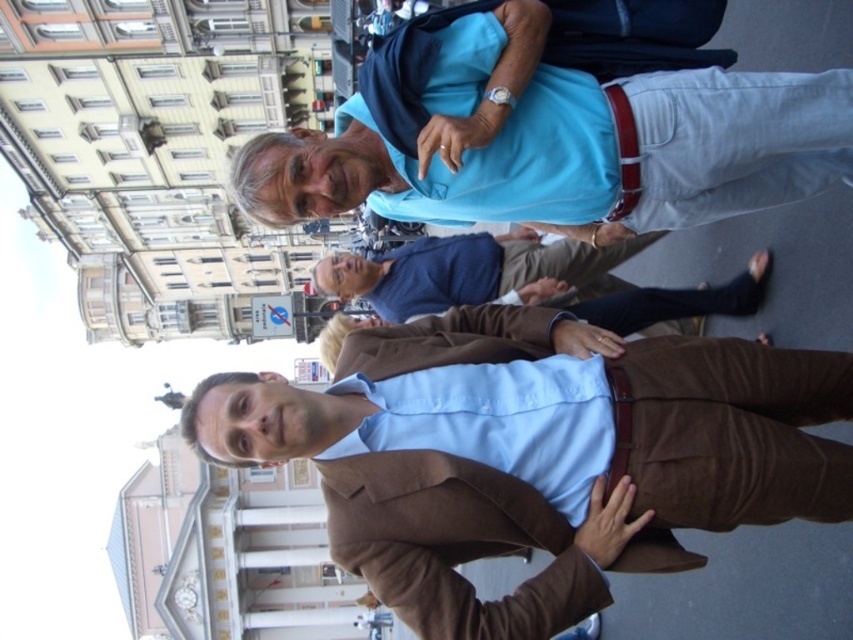
You are a photographer trying to capture a group photo of the two people in the scene. The light blue fabric shirt at upper center and the blue cotton shirt at center are both visible in your frame. Which shirt should you focus on to ensure it appears larger in the final photo?

You should focus on the blue cotton shirt at center because it is larger than the light blue fabric shirt at upper center, so it will appear bigger in the photo.